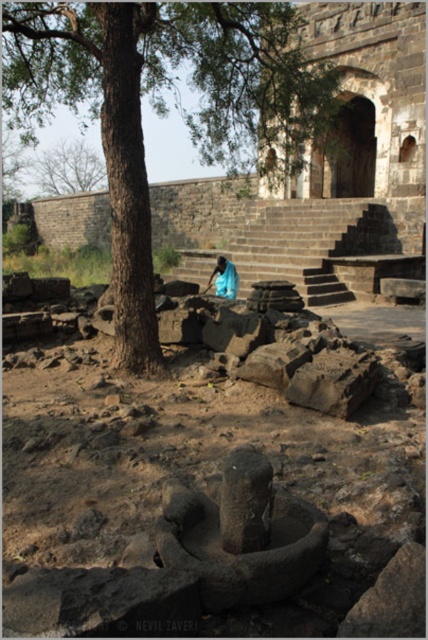
You are a photographer trying to capture a clear photo of the blue fabric person at center. However, the brown earthy dirt field at center is blocking part of the view. Can you adjust your position to avoid the dirt field while still keeping the person in the frame?

The brown earthy dirt field at center is positioned under the blue fabric person at center, so moving your camera angle upwards would allow you to capture the blue fabric person at center without the dirt field obstructing the view.

You are standing at the point marked as point [211,497] in the image. What type of terrain are you currently standing on?

The point [211,497] is located on a brown earthy dirt field at center, so you are standing on dirt terrain.